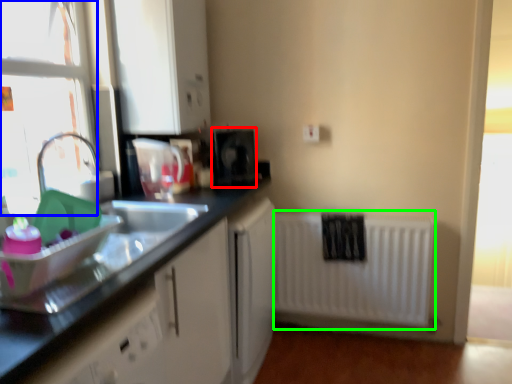
Question: Estimate the real-world distances between objects in this image. Which object is closer to appliance (highlighted by a red box), window frame (highlighted by a blue box) or radiator (highlighted by a green box)?

Choices:
 (A) window frame
 (B) radiator

Answer: (B)